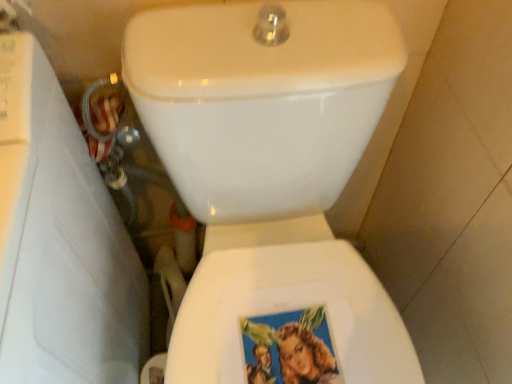
The width and height of the screenshot is (512, 384). Describe the element at coordinates (272, 185) in the screenshot. I see `white glossy toilet at center` at that location.

Where is `white glossy toilet at center`? Image resolution: width=512 pixels, height=384 pixels. white glossy toilet at center is located at coordinates (272, 185).

This screenshot has height=384, width=512. What are the coordinates of `white glossy toilet at center` in the screenshot? It's located at (272, 185).